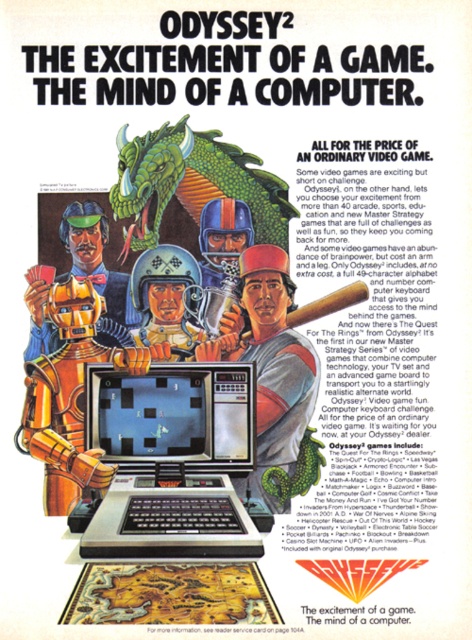
Question: Does silver metallic laptop at center have a larger size compared to green matte dragon at upper center?

Choices:
 (A) no
 (B) yes

Answer: (B)

Question: Which point is farther to the camera?

Choices:
 (A) (124, 168)
 (B) (202, 484)

Answer: (A)

Question: Which point appears farthest from the camera in this image?

Choices:
 (A) (228, 468)
 (B) (187, 204)

Answer: (B)

Question: Does silver metallic laptop at center have a smaller size compared to green matte dragon at upper center?

Choices:
 (A) no
 (B) yes

Answer: (A)

Question: Does silver metallic laptop at center appear on the right side of green matte dragon at upper center?

Choices:
 (A) yes
 (B) no

Answer: (B)